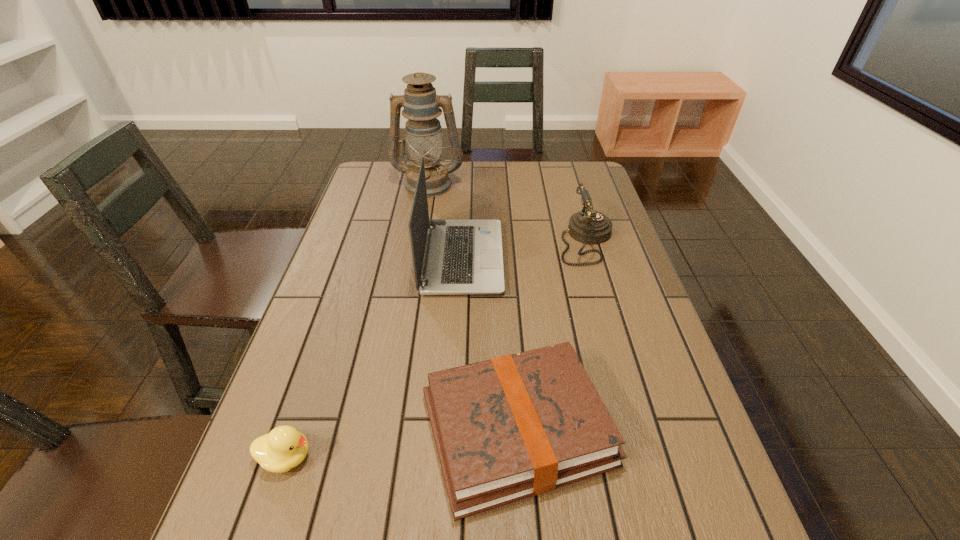
In order to click on the farthest object in this screenshot , I will do `click(423, 135)`.

Where is `oil lamp`? The height and width of the screenshot is (540, 960). oil lamp is located at coordinates (423, 135).

Identify the location of the fourth shortest object. (461, 257).

Locate an element on the screen. The height and width of the screenshot is (540, 960). telephone is located at coordinates (588, 226).

Where is `hardback book`? The width and height of the screenshot is (960, 540). hardback book is located at coordinates (515, 426).

I want to click on duckling, so click(284, 448).

Image resolution: width=960 pixels, height=540 pixels. In order to click on vacant region located 0.200m on the front of the oil lamp in this screenshot , I will do `click(420, 233)`.

You are a GUI agent. You are given a task and a screenshot of the screen. Output one action in this format:
    pyautogui.click(x=<x>, y=<y>)
    Task: Click on the vacant space positioned on the screen of the second tallest object
    This screenshot has height=540, width=960.
    Given the screenshot: What is the action you would take?
    pyautogui.click(x=566, y=258)

Locate an element on the screen. This screenshot has height=540, width=960. vacant space situated 0.290m on the front of the third shortest object is located at coordinates (617, 350).

At what (x,y) coordinates should I click in order to perform the action: click on vacant space located on the right of the hardback book. Please return your answer as a coordinate pair (x, y). This screenshot has height=540, width=960. Looking at the image, I should click on (691, 429).